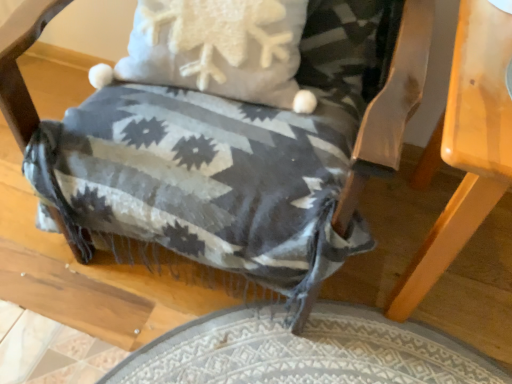
Question: From the image's perspective, is light brown wooden table at lower right on top of woven fabric blanket at center?

Choices:
 (A) yes
 (B) no

Answer: (B)

Question: Does light brown wooden table at lower right have a larger size compared to woven fabric blanket at center?

Choices:
 (A) yes
 (B) no

Answer: (B)

Question: Is the depth of light brown wooden table at lower right greater than that of woven fabric blanket at center?

Choices:
 (A) yes
 (B) no

Answer: (A)

Question: Would you consider light brown wooden table at lower right to be distant from woven fabric blanket at center?

Choices:
 (A) no
 (B) yes

Answer: (A)

Question: Does light brown wooden table at lower right have a lesser width compared to woven fabric blanket at center?

Choices:
 (A) no
 (B) yes

Answer: (B)

Question: Is light brown wooden table at lower right positioned before woven fabric blanket at center?

Choices:
 (A) no
 (B) yes

Answer: (A)

Question: Does woven fabric blanket at center have a greater width compared to light brown wooden table at lower right?

Choices:
 (A) yes
 (B) no

Answer: (A)

Question: From the image's perspective, is woven fabric blanket at center on top of light brown wooden table at lower right?

Choices:
 (A) no
 (B) yes

Answer: (B)

Question: Is woven fabric blanket at center thinner than light brown wooden table at lower right?

Choices:
 (A) no
 (B) yes

Answer: (A)

Question: From the image's perspective, is woven fabric blanket at center located beneath light brown wooden table at lower right?

Choices:
 (A) no
 (B) yes

Answer: (A)

Question: Is woven fabric blanket at center turned away from light brown wooden table at lower right?

Choices:
 (A) no
 (B) yes

Answer: (A)

Question: From a real-world perspective, is woven fabric blanket at center positioned under light brown wooden table at lower right based on gravity?

Choices:
 (A) yes
 (B) no

Answer: (B)

Question: Is point (506, 107) closer or farther from the camera than point (301, 271)?

Choices:
 (A) closer
 (B) farther

Answer: (A)